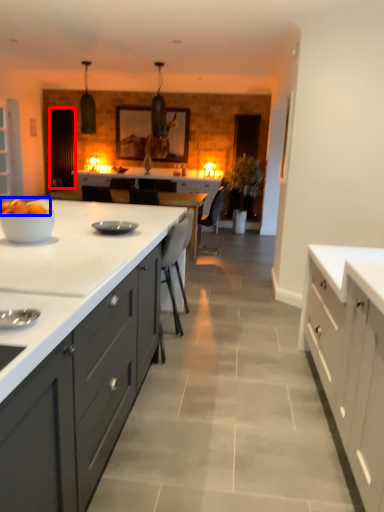
Question: Which object appears closest to the camera in this image, glass door (highlighted by a red box) or fruit (highlighted by a blue box)?

Choices:
 (A) glass door
 (B) fruit

Answer: (B)